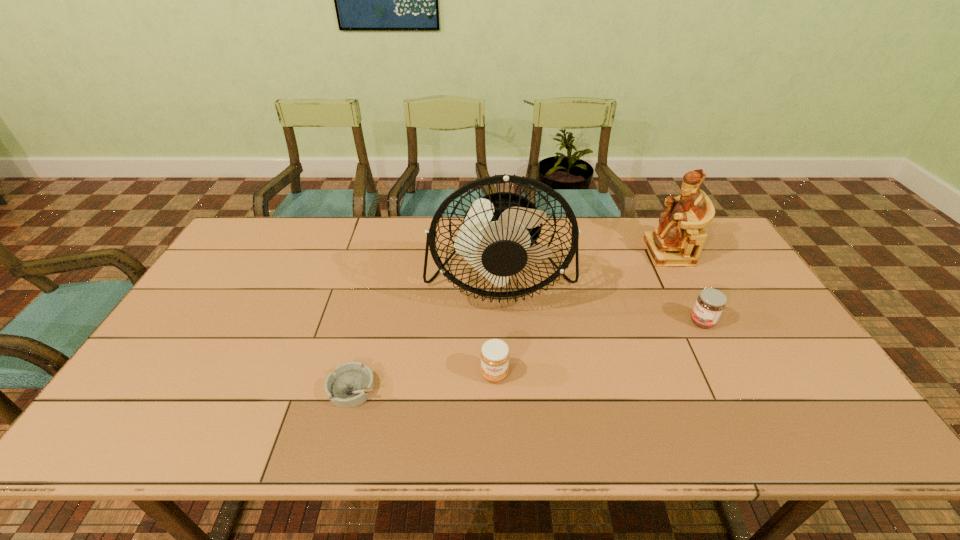
You are a GUI agent. You are given a task and a screenshot of the screen. Output one action in this format:
    pyautogui.click(x=<x>, y=<y>)
    Task: Click on the free space located 0.170m on the front of the farther jam
    
    Given the screenshot: What is the action you would take?
    pyautogui.click(x=733, y=383)

You are a GUI agent. You are given a task and a screenshot of the screen. Output one action in this format:
    pyautogui.click(x=<x>, y=<y>)
    Task: Click on the vacant space located on the front label of the left jam
    
    Given the screenshot: What is the action you would take?
    pyautogui.click(x=495, y=404)

At what (x,y) coordinates should I click in order to perform the action: click on vacant space situated 0.380m on the left of the shortest object. Please return your answer as a coordinate pair (x, y). The height and width of the screenshot is (540, 960). Looking at the image, I should click on (170, 388).

Locate an element on the screen. fan that is at the far edge is located at coordinates (497, 237).

Locate an element on the screen. figurine positioned at the far edge is located at coordinates (678, 241).

Locate an element on the screen. The width and height of the screenshot is (960, 540). object at the right edge is located at coordinates (678, 241).

At what (x,y) coordinates should I click in order to perform the action: click on object that is at the far right corner. Please return your answer as a coordinate pair (x, y). Image resolution: width=960 pixels, height=540 pixels. Looking at the image, I should click on (678, 241).

Image resolution: width=960 pixels, height=540 pixels. In the image, there is a desktop. What are the coordinates of `vacant space at the far edge` in the screenshot? It's located at (309, 232).

At what (x,y) coordinates should I click in order to perform the action: click on blank space at the near edge. Please return your answer as a coordinate pair (x, y). Looking at the image, I should click on (380, 420).

This screenshot has height=540, width=960. I want to click on vacant space at the left edge of the desktop, so click(x=221, y=282).